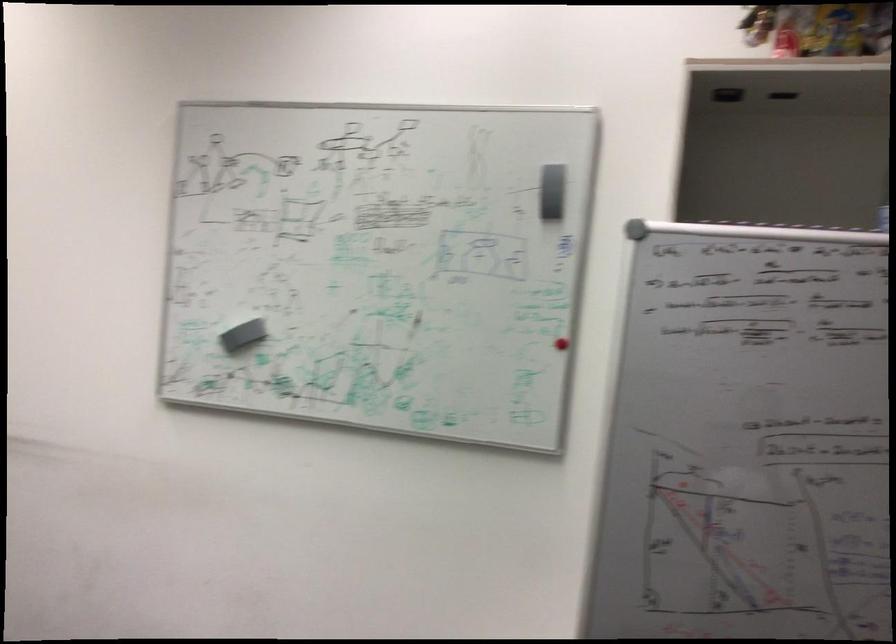
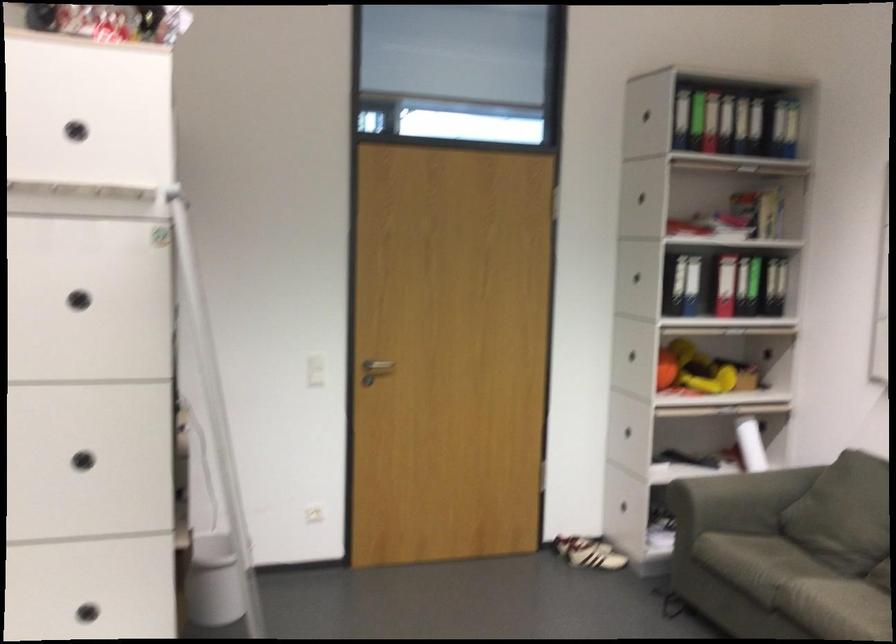
In the second image, find the point that corresponds to point 679,366 in the first image.

(80, 288)